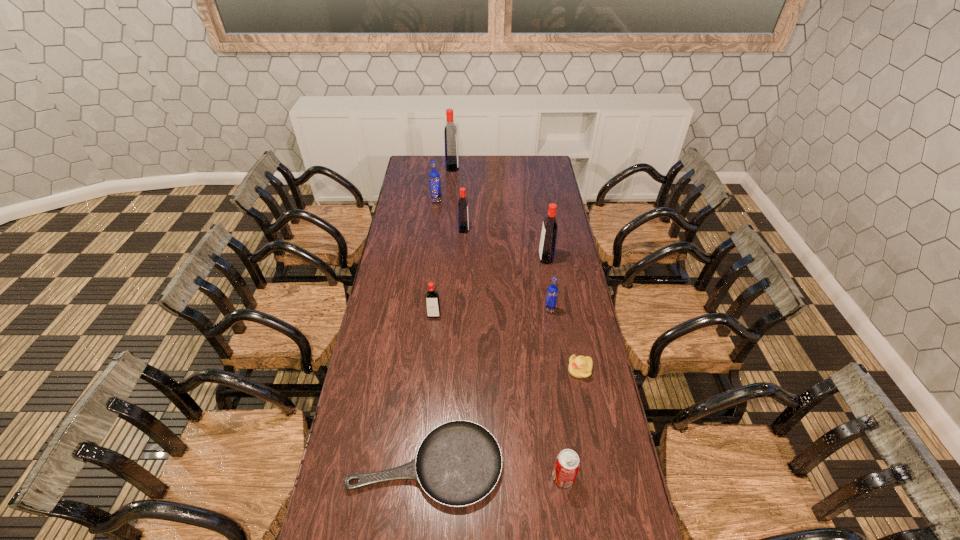
This screenshot has width=960, height=540. I want to click on vacant region between the duckling and the eighth nearest object, so click(508, 285).

Identify the location of free space between the tallest vodka and the second tallest vodka. The height and width of the screenshot is (540, 960). (499, 213).

Where is `free space that is in between the second farthest object and the yellow duckling`? free space that is in between the second farthest object and the yellow duckling is located at coordinates (508, 285).

The height and width of the screenshot is (540, 960). Identify the location of vacant area that lies between the right blue vodka and the duckling. (564, 340).

Locate an element on the screen. free space between the second biggest red vodka and the nearer blue vodka is located at coordinates (548, 284).

Identify the location of free space between the seventh nearest object and the nearest red vodka. Image resolution: width=960 pixels, height=540 pixels. [x=449, y=272].

The width and height of the screenshot is (960, 540). Find the location of `object that is the eighth closest to the right blue vodka`. object that is the eighth closest to the right blue vodka is located at coordinates (450, 132).

Where is `object that can be found as the closest to the second farthest object`? Image resolution: width=960 pixels, height=540 pixels. object that can be found as the closest to the second farthest object is located at coordinates (463, 218).

Image resolution: width=960 pixels, height=540 pixels. Identify the location of vodka that stands as the third closest to the shortest object. (547, 245).

The width and height of the screenshot is (960, 540). Identify the location of the fourth closest vodka to the smallest red vodka. (434, 178).